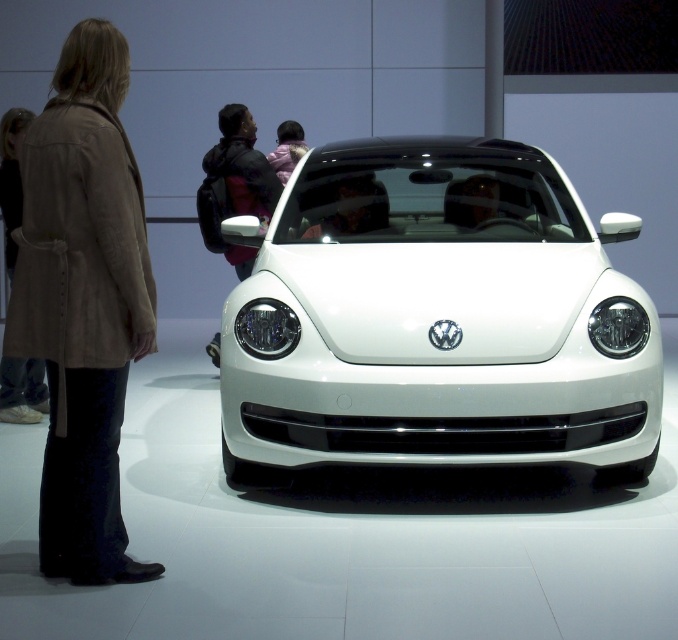
Between white glossy car at center and suede coat at left, which one appears on the right side from the viewer's perspective?

white glossy car at center is more to the right.

Does white glossy car at center have a lesser height compared to suede coat at left?

Yes.

What do you see at coordinates (437, 317) in the screenshot?
I see `white glossy car at center` at bounding box center [437, 317].

Image resolution: width=678 pixels, height=640 pixels. In order to click on white glossy car at center in this screenshot , I will do `click(437, 317)`.